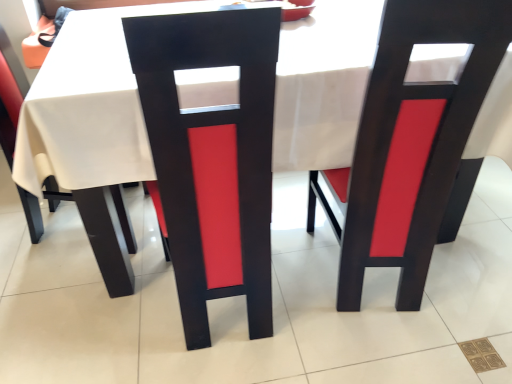
Identify the location of free location to the left of matte black chair at center, positioned as the 2th chair in left-to-right order. (113, 312).